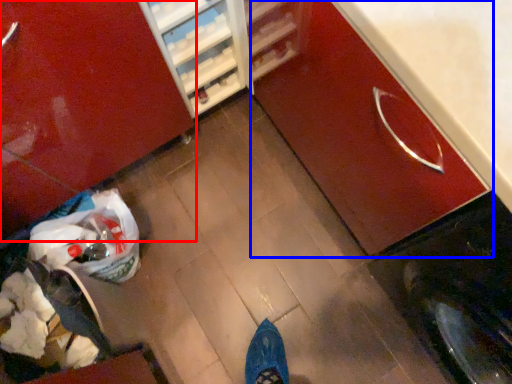
Question: Which object appears closest to the camera in this image, cabinetry (highlighted by a red box) or cabinetry (highlighted by a blue box)?

Choices:
 (A) cabinetry
 (B) cabinetry

Answer: (B)